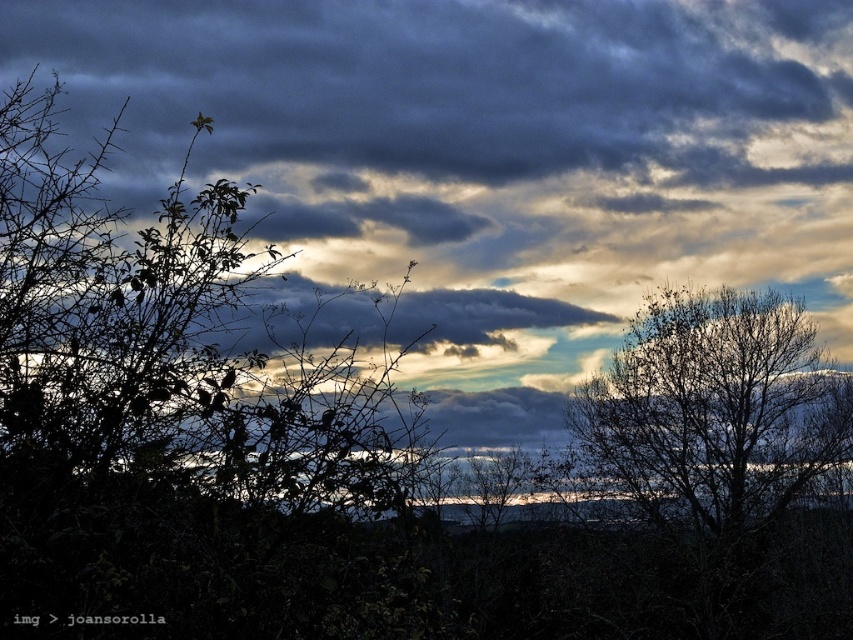
Question: From the image, what is the correct spatial relationship of green matte tree at left in relation to bare branches at upper right?

Choices:
 (A) left
 (B) right

Answer: (A)

Question: Is cloudy sky at upper center closer to the viewer compared to green matte tree at left?

Choices:
 (A) yes
 (B) no

Answer: (B)

Question: Estimate the real-world distances between objects in this image. Which object is closer to the bare branches at upper right?

Choices:
 (A) cloudy sky at upper center
 (B) green matte tree at left

Answer: (A)

Question: Among these points, which one is nearest to the camera?

Choices:
 (A) (352, 506)
 (B) (564, 304)
 (C) (648, 387)

Answer: (A)

Question: Does cloudy sky at upper center have a larger size compared to bare branches at upper right?

Choices:
 (A) yes
 (B) no

Answer: (A)

Question: Among these objects, which one is nearest to the camera?

Choices:
 (A) bare branches at upper right
 (B) green matte tree at left

Answer: (B)